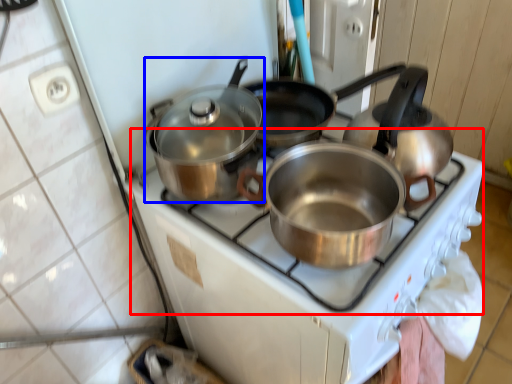
Question: Which of the following is the farthest to the observer, gas stove (highlighted by a red box) or kitchen appliance (highlighted by a blue box)?

Choices:
 (A) gas stove
 (B) kitchen appliance

Answer: (B)